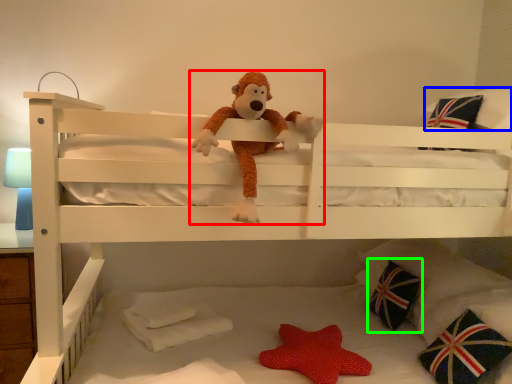
Question: Which is nearer to the toy (highlighted by a red box)? pillow (highlighted by a blue box) or pillow (highlighted by a green box).

Choices:
 (A) pillow
 (B) pillow

Answer: (A)